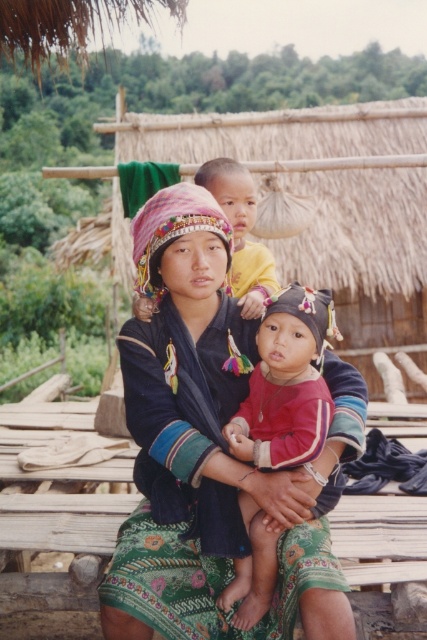
You are a photographer planning to take a group photo of the two central figures in the scene. Given that the embroidered fabric dress at center and the matte yellow shirt at center are part of their outfits, which one would require more space to ensure the entire garment is visible in the photo?

The embroidered fabric dress at center is bigger than the matte yellow shirt at center, so it would require more space to ensure the entire garment is visible in the photo.

You are a photographer planning to take a portrait of the two central figures wearing the embroidered fabric dress at center and the matte red shirt at center. To ensure both are centered in the frame, which direction should you move the camera slightly?

You should move the camera slightly to the right because the embroidered fabric dress at center is positioned on the left side of the matte red shirt at center, so shifting the camera right will center both figures.